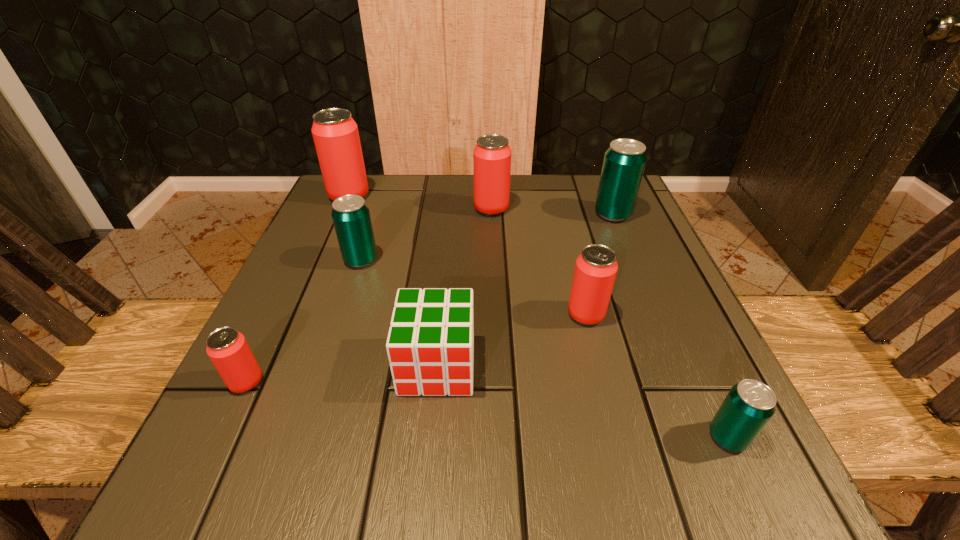
The height and width of the screenshot is (540, 960). In order to click on the biggest red beer can in this screenshot , I will do `click(335, 133)`.

Where is `the tallest object`? Image resolution: width=960 pixels, height=540 pixels. the tallest object is located at coordinates [x=335, y=133].

This screenshot has height=540, width=960. I want to click on the fourth beer can from right to left, so click(x=492, y=155).

Locate an element on the screen. The width and height of the screenshot is (960, 540). the second red beer can from right to left is located at coordinates (492, 155).

This screenshot has height=540, width=960. I want to click on the biggest teal beer can, so click(x=624, y=161).

The height and width of the screenshot is (540, 960). I want to click on the second farthest teal beer can, so click(x=351, y=217).

Where is `the fourth farthest object`? The width and height of the screenshot is (960, 540). the fourth farthest object is located at coordinates (351, 217).

Where is `the sixth object from left to right`? This screenshot has height=540, width=960. the sixth object from left to right is located at coordinates (596, 267).

At what (x,y) coordinates should I click in order to perform the action: click on the fifth farthest object. Please return your answer as a coordinate pair (x, y). Looking at the image, I should click on (596, 267).

I want to click on red cube, so click(430, 345).